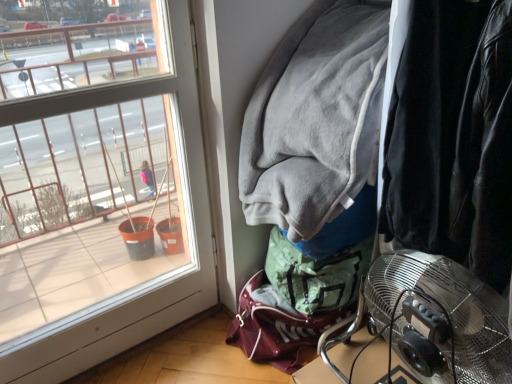
Question: Considering the relative positions of velvet black jacket at right and gray fleece jacket at upper right in the image provided, is velvet black jacket at right to the left or to the right of gray fleece jacket at upper right?

Choices:
 (A) right
 (B) left

Answer: (A)

Question: Relative to gray fleece jacket at upper right, is velvet black jacket at right in front or behind?

Choices:
 (A) behind
 (B) front

Answer: (B)

Question: Considering the real-world distances, which object is closest to the gray fleece jacket at upper right?

Choices:
 (A) velvet black jacket at right
 (B) metallic silver fan at lower right
 (C) clear glass window at left

Answer: (A)

Question: Which object is the closest to the metallic silver fan at lower right?

Choices:
 (A) clear glass window at left
 (B) gray fleece jacket at upper right
 (C) velvet black jacket at right

Answer: (C)